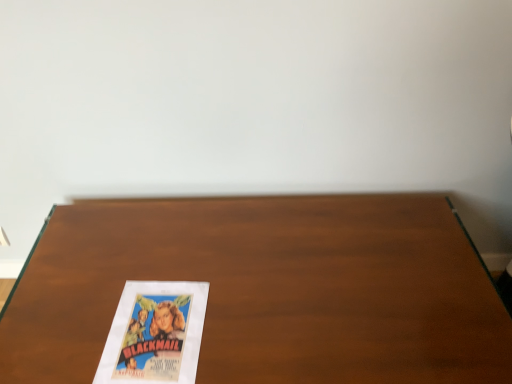
Question: Considering the positions of wooden table at center and vintage paper at bottom left in the image, is wooden table at center taller or shorter than vintage paper at bottom left?

Choices:
 (A) short
 (B) tall

Answer: (B)

Question: Does point (237, 284) appear closer or farther from the camera than point (175, 294)?

Choices:
 (A) closer
 (B) farther

Answer: (B)

Question: Looking at the image, does wooden table at center seem bigger or smaller compared to vintage paper at bottom left?

Choices:
 (A) big
 (B) small

Answer: (A)

Question: Is vintage paper at bottom left wider or thinner than wooden table at center?

Choices:
 (A) thin
 (B) wide

Answer: (A)

Question: Would you say vintage paper at bottom left is to the left or to the right of wooden table at center in the picture?

Choices:
 (A) right
 (B) left

Answer: (B)

Question: Which is correct: vintage paper at bottom left is inside wooden table at center, or outside of it?

Choices:
 (A) inside
 (B) outside

Answer: (A)

Question: Relative to wooden table at center, is vintage paper at bottom left in front or behind?

Choices:
 (A) front
 (B) behind

Answer: (A)